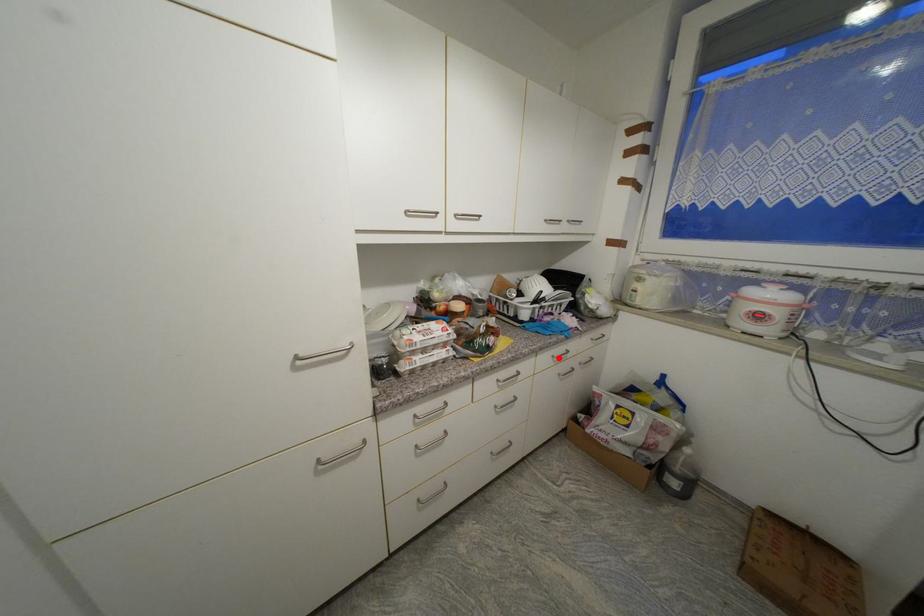
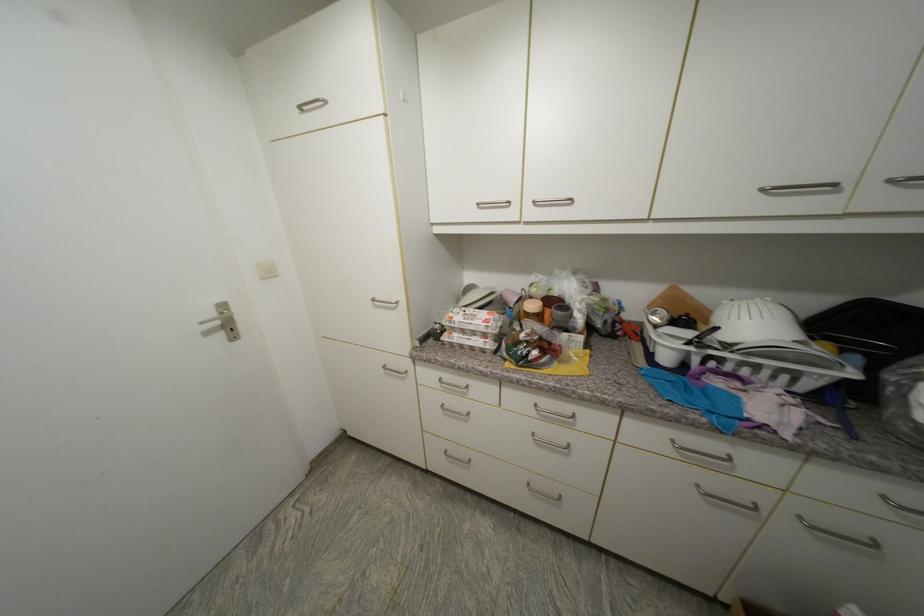
Question: A red point is marked in image1. In image2, is the corresponding 3D point closer to the camera or farther? Reply with the corresponding letter.

Choices:
 (A) The corresponding 3D point is closer.
 (B) The corresponding 3D point is farther.

Answer: (A)